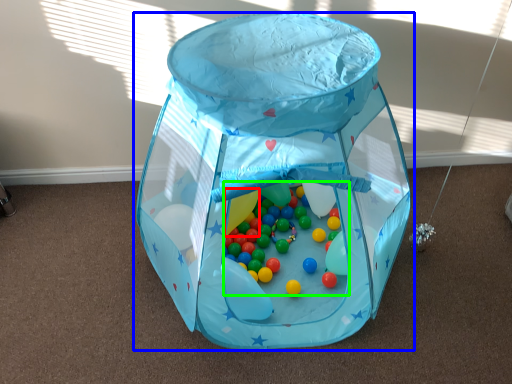
Question: Based on their relative distances, which object is farther from balloon (highlighted by a red box)? Choose from toy (highlighted by a blue box) and toy (highlighted by a green box).

Choices:
 (A) toy
 (B) toy

Answer: (A)